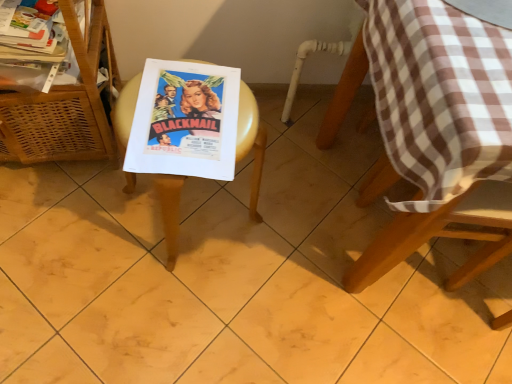
The image size is (512, 384). What are the coordinates of `vacant area that is in front of wooden picnic table at center` in the screenshot? It's located at (160, 304).